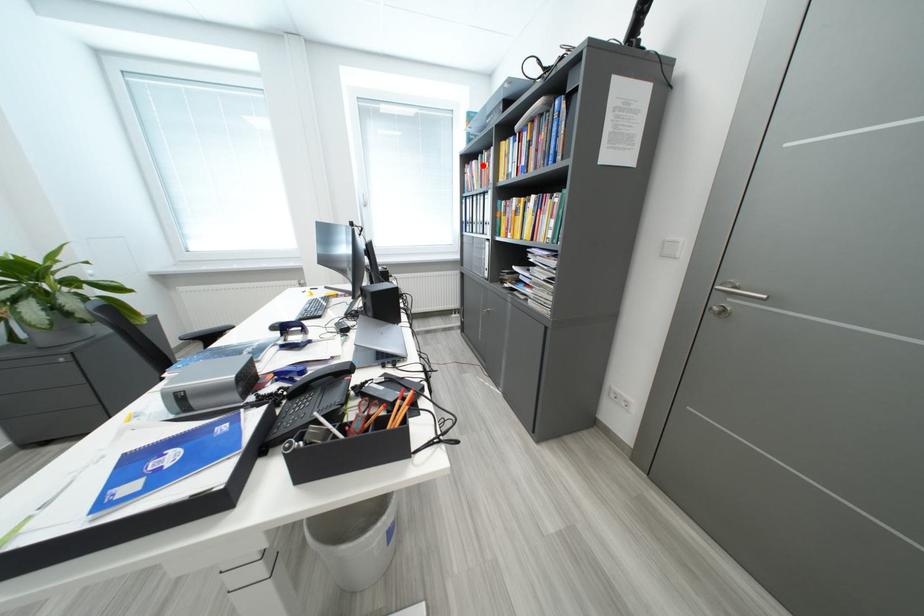
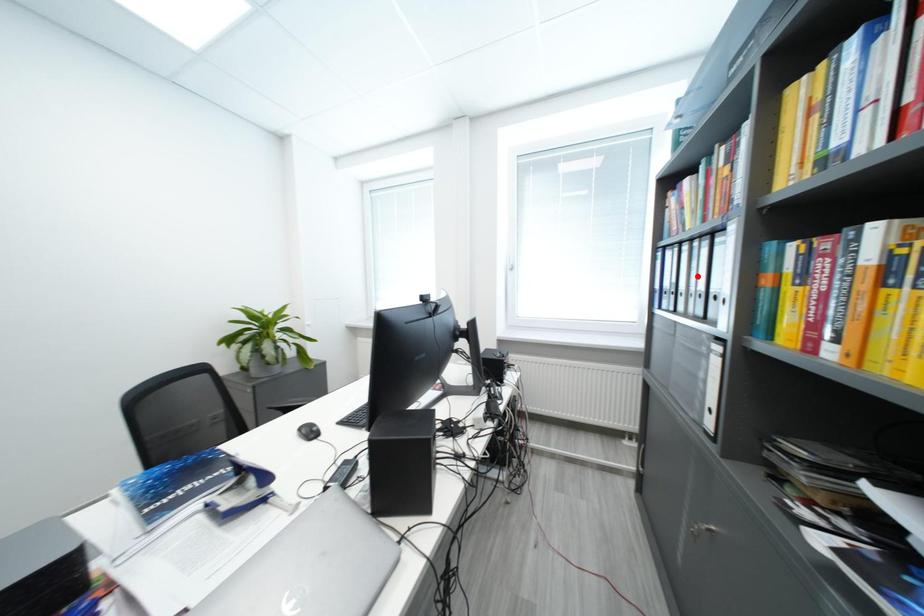
I am providing you with two images of the same scene from different viewpoints. A red point is marked on the first image and another point is marked on the second image. Does the point marked in image1 correspond to the same location as the one in image2?

No